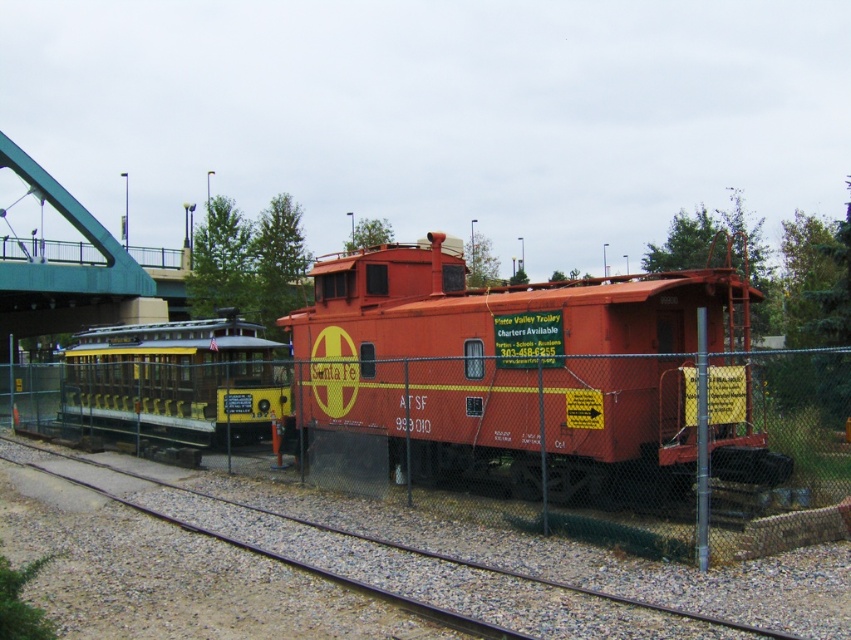
Question: Can you confirm if metal chain-link fence at center is thinner than yellow polished metal trolley at center?

Choices:
 (A) yes
 (B) no

Answer: (B)

Question: Which point is closer to the camera taking this photo?

Choices:
 (A) 567,346
 (B) 163,368
 (C) 309,388
 (D) 666,605

Answer: (D)

Question: Can you confirm if yellow polished metal trolley at center is positioned below metal train track at lower center?

Choices:
 (A) yes
 (B) no

Answer: (B)

Question: Which point is farther from the camera taking this photo?

Choices:
 (A) (820, 532)
 (B) (612, 602)
 (C) (84, 348)

Answer: (C)

Question: Where is metal chain-link fence at center located in relation to yellow polished metal trolley at center in the image?

Choices:
 (A) below
 (B) above

Answer: (A)

Question: Which of the following is the closest to the observer?

Choices:
 (A) matte red caboose at center
 (B) yellow polished metal trolley at center
 (C) metal chain-link fence at center

Answer: (C)